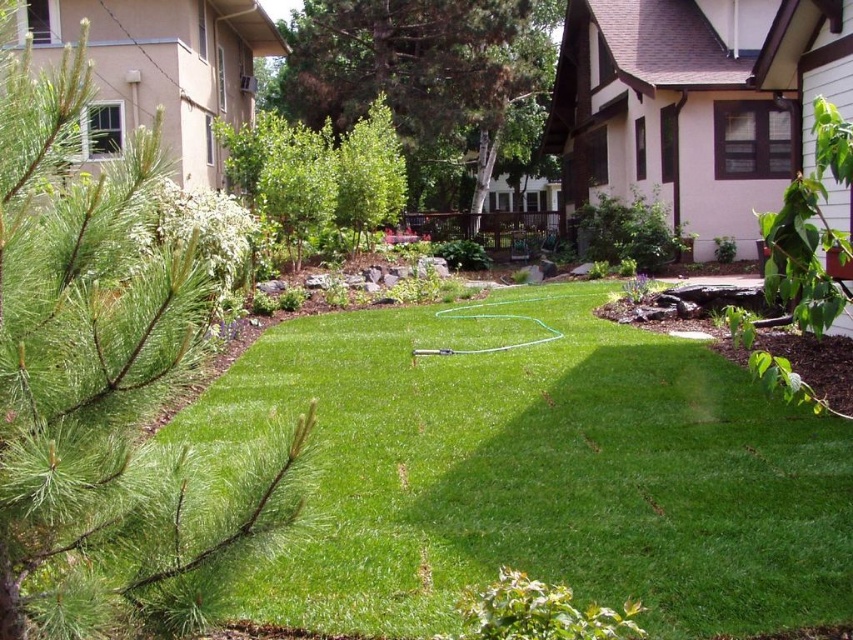
Who is positioned more to the left, green grass at center or green needle-like at left?

From the viewer's perspective, green needle-like at left appears more on the left side.

Identify the location of green grass at center. Image resolution: width=853 pixels, height=640 pixels. (538, 470).

In order to click on green grass at center in this screenshot , I will do `click(538, 470)`.

Can you confirm if green grass at center is taller than green leafy tree at upper center?

No.

Which is in front, point (762, 449) or point (438, 157)?

Point (762, 449) is in front.

The width and height of the screenshot is (853, 640). I want to click on green grass at center, so click(538, 470).

Find the location of a particular element. This screenshot has height=640, width=853. green grass at center is located at coordinates (538, 470).

Does green needle-like at left appear under green leafy tree at upper center?

Correct, green needle-like at left is located below green leafy tree at upper center.

Between green needle-like at left and green leafy tree at upper center, which one has less height?

green needle-like at left

This screenshot has width=853, height=640. In order to click on green needle-like at left in this screenshot , I will do `click(99, 381)`.